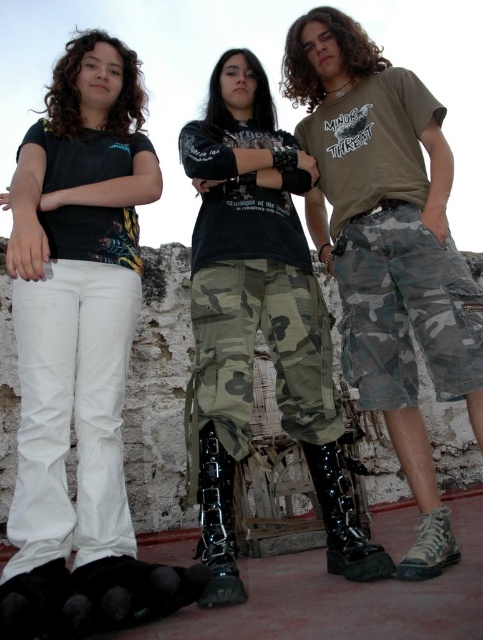
Question: Which object is closer to the camera taking this photo?

Choices:
 (A) glossy black boots at lower center
 (B) camo fabric pants at center
 (C) black leather boot at center
 (D) camo shorts at center

Answer: (D)

Question: Is camo fabric pants at center to the left of camo fabric shorts at right from the viewer's perspective?

Choices:
 (A) no
 (B) yes

Answer: (B)

Question: Observing the image, what is the correct spatial positioning of camo fabric shorts at right in reference to black leather boot at center?

Choices:
 (A) below
 (B) above

Answer: (B)

Question: Which of these objects is positioned farthest from the camo shorts at center?

Choices:
 (A) camo fabric pants at center
 (B) camo fabric shorts at right
 (C) black leather boot at center
 (D) white cotton pants at center

Answer: (C)

Question: Does camo fabric pants at center have a larger size compared to black leather boot at center?

Choices:
 (A) no
 (B) yes

Answer: (B)

Question: Which point is farther to the camera?

Choices:
 (A) black leather boot at center
 (B) camo shorts at center
 (C) camo fabric shorts at right

Answer: (C)